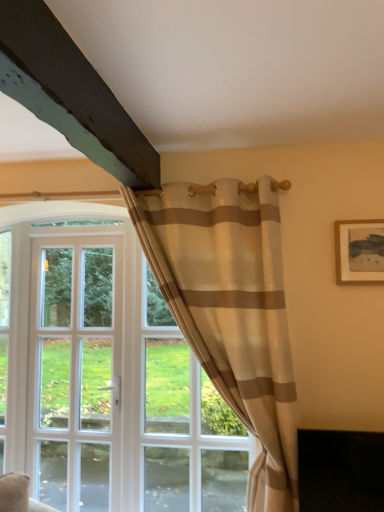
Question: Visually, is beige striped fabric at center positioned to the left or to the right of white glass door at left?

Choices:
 (A) right
 (B) left

Answer: (A)

Question: Is beige striped fabric at center inside the boundaries of white glass door at left, or outside?

Choices:
 (A) inside
 (B) outside

Answer: (B)

Question: Which object is positioned farthest from the wooden framed artwork at upper right?

Choices:
 (A) beige striped fabric at center
 (B) white glass door at left

Answer: (B)

Question: Which object is positioned closest to the beige striped fabric at center?

Choices:
 (A) white glass door at left
 (B) wooden framed artwork at upper right

Answer: (B)